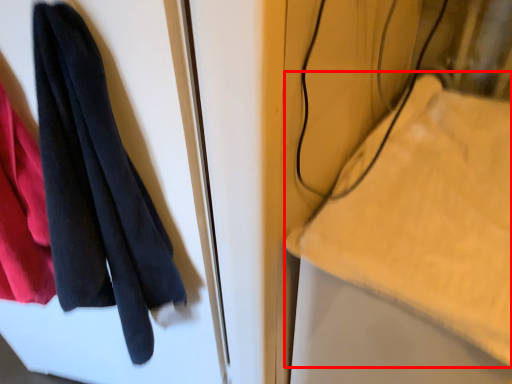
Question: Observing the image, what is the correct spatial positioning of cloth (annotated by the red box) in reference to towel?

Choices:
 (A) left
 (B) right

Answer: (B)